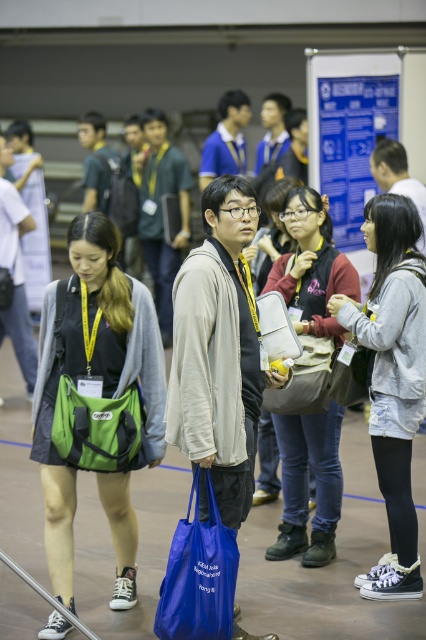
Looking at this image, you are organizing a charity event and need to place a large poster between the green fabric bag at left and the gray cotton hoodie at center. The poster is 1.2 meters wide. Can the space between them accommodate the poster?

The green fabric bag at left is wider than the gray cotton hoodie at center. However, the description only provides information about their widths relative to each other, not the actual distance between them. Without knowing the exact distance between the two objects, it is impossible to determine if the poster will fit.

You are at an event and need to retrieve your gray cotton hoodie at center from behind the green fabric bag at left. Can you easily reach it without moving the bag?

The green fabric bag at left is in front of the gray cotton hoodie at center, so you cannot easily reach the gray cotton hoodie at center without moving the bag.

Consider the image. You are standing in the large hall and want to move from one point to another. The first point is at coordinate point (403, 205) and the second point is at coordinate point (319, 384). Which point is closer to you?

Point (403, 205) is closer to the viewer than point (319, 384).